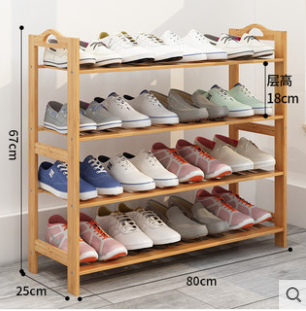
You are a GUI agent. You are given a task and a screenshot of the screen. Output one action in this format:
    pyautogui.click(x=<x>, y=<y>)
    Task: Click on the shoes on the top shelf
    This screenshot has height=311, width=306.
    Given the screenshot: What is the action you would take?
    pyautogui.click(x=79, y=58), pyautogui.click(x=107, y=57), pyautogui.click(x=131, y=48), pyautogui.click(x=157, y=48), pyautogui.click(x=185, y=46), pyautogui.click(x=210, y=43), pyautogui.click(x=228, y=43), pyautogui.click(x=251, y=41)